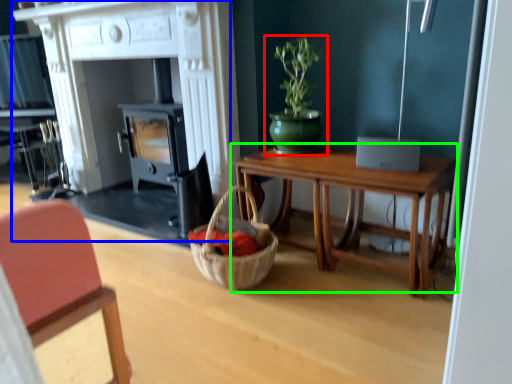
Question: Which object is the closest to the houseplant (highlighted by a red box)? Choose among these: fireplace (highlighted by a blue box) or table (highlighted by a green box).

Choices:
 (A) fireplace
 (B) table

Answer: (B)